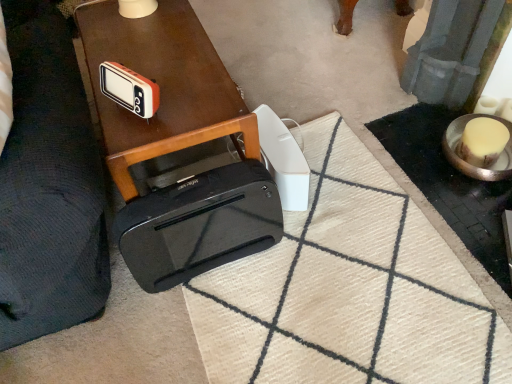
Question: Is white plastic remote control at center, positioned as the second gadget in front-to-back order, completely or partially outside of orange plastic radio at upper left, placed as the second gadget when sorted from right to left?

Choices:
 (A) yes
 (B) no

Answer: (A)

Question: Is white plastic remote control at center, which is the 2th gadget from left to right, closer to camera compared to orange plastic radio at upper left, acting as the 1th gadget starting from the front?

Choices:
 (A) no
 (B) yes

Answer: (A)

Question: Does white plastic remote control at center, acting as the 1th gadget starting from the right, turn towards orange plastic radio at upper left, arranged as the second gadget when viewed from the back?

Choices:
 (A) yes
 (B) no

Answer: (B)

Question: Considering the relative sizes of white plastic remote control at center, acting as the 1th gadget starting from the right, and orange plastic radio at upper left, placed as the second gadget when sorted from right to left, in the image provided, is white plastic remote control at center, acting as the 1th gadget starting from the right, bigger than orange plastic radio at upper left, placed as the second gadget when sorted from right to left,?

Choices:
 (A) no
 (B) yes

Answer: (B)

Question: From a real-world perspective, is white plastic remote control at center, which is the 2th gadget from left to right, physically above orange plastic radio at upper left, arranged as the second gadget when viewed from the back?

Choices:
 (A) yes
 (B) no

Answer: (B)

Question: From a real-world perspective, is white plastic remote control at center, which is the 2th gadget from left to right, physically below orange plastic radio at upper left, placed as the second gadget when sorted from right to left?

Choices:
 (A) no
 (B) yes

Answer: (B)

Question: Can you confirm if orange plastic radio at upper left, arranged as the second gadget when viewed from the back, is taller than beige textured doormat at center?

Choices:
 (A) no
 (B) yes

Answer: (B)

Question: Considering the relative sizes of orange plastic radio at upper left, placed as the second gadget when sorted from right to left, and beige textured doormat at center in the image provided, is orange plastic radio at upper left, placed as the second gadget when sorted from right to left, wider than beige textured doormat at center?

Choices:
 (A) yes
 (B) no

Answer: (B)

Question: Is orange plastic radio at upper left, placed as the second gadget when sorted from right to left, facing towards beige textured doormat at center?

Choices:
 (A) yes
 (B) no

Answer: (B)

Question: Is orange plastic radio at upper left, arranged as the second gadget when viewed from the back, at the left side of beige textured doormat at center?

Choices:
 (A) yes
 (B) no

Answer: (A)

Question: Can we say orange plastic radio at upper left, placed as the second gadget when sorted from right to left, lies outside beige textured doormat at center?

Choices:
 (A) no
 (B) yes

Answer: (B)

Question: Is orange plastic radio at upper left, which is the 1th gadget from left to right, directly adjacent to beige textured doormat at center?

Choices:
 (A) yes
 (B) no

Answer: (B)

Question: Does white plastic remote control at center, acting as the 1th gadget starting from the right, appear on the left side of shiny brown table at center?

Choices:
 (A) no
 (B) yes

Answer: (A)